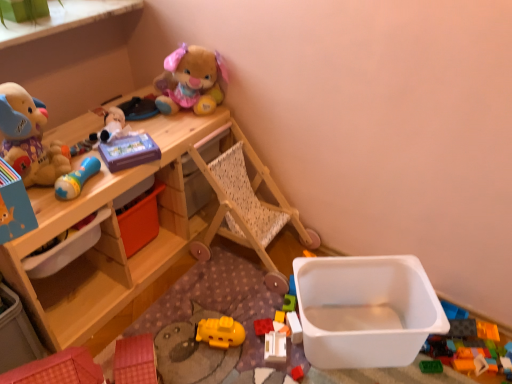
Locate an element on the screen. free point in front of yellow plastic submarine at center, which ranks as the fourth toy in bottom-to-top order is located at coordinates (220, 368).